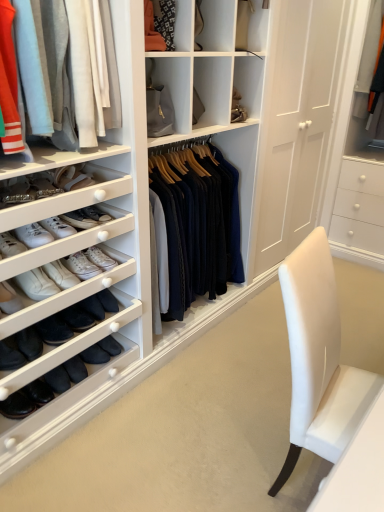
Question: Is there a large distance between matte orange fabric at upper center and light gray cotton pants at upper left?

Choices:
 (A) no
 (B) yes

Answer: (A)

Question: Would you say matte orange fabric at upper center is outside light gray cotton pants at upper left?

Choices:
 (A) no
 (B) yes

Answer: (B)

Question: Does matte orange fabric at upper center have a greater width compared to light gray cotton pants at upper left?

Choices:
 (A) yes
 (B) no

Answer: (B)

Question: Considering the relative positions of matte orange fabric at upper center and light gray cotton pants at upper left in the image provided, is matte orange fabric at upper center to the right of light gray cotton pants at upper left from the viewer's perspective?

Choices:
 (A) yes
 (B) no

Answer: (A)

Question: Could you tell me if matte orange fabric at upper center is facing light gray cotton pants at upper left?

Choices:
 (A) no
 (B) yes

Answer: (A)

Question: Considering the relative sizes of matte orange fabric at upper center and light gray cotton pants at upper left in the image provided, is matte orange fabric at upper center shorter than light gray cotton pants at upper left?

Choices:
 (A) yes
 (B) no

Answer: (A)

Question: Considering the relative positions of matte orange fabric at upper center and white leather sneakers at left in the image provided, is matte orange fabric at upper center in front of white leather sneakers at left?

Choices:
 (A) yes
 (B) no

Answer: (B)

Question: Does matte orange fabric at upper center have a lesser height compared to white leather sneakers at left?

Choices:
 (A) no
 (B) yes

Answer: (A)

Question: Is the depth of matte orange fabric at upper center greater than that of white leather sneakers at left?

Choices:
 (A) no
 (B) yes

Answer: (B)

Question: Is matte orange fabric at upper center to the left of white leather sneakers at left from the viewer's perspective?

Choices:
 (A) yes
 (B) no

Answer: (B)

Question: Can you confirm if matte orange fabric at upper center is positioned to the right of white leather sneakers at left?

Choices:
 (A) yes
 (B) no

Answer: (A)

Question: Is matte orange fabric at upper center positioned with its back to white leather sneakers at left?

Choices:
 (A) no
 (B) yes

Answer: (A)

Question: Is white leather sneakers at left at the back of light gray cotton pants at upper left?

Choices:
 (A) no
 (B) yes

Answer: (A)